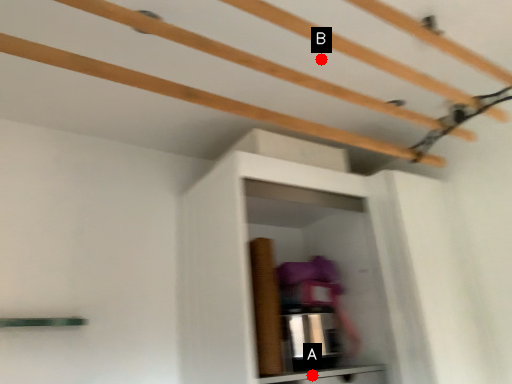
Question: Two points are circled on the image, labeled by A and B beside each circle. Among these points, which one is nearest to the camera?

Choices:
 (A) A is closer
 (B) B is closer

Answer: (B)